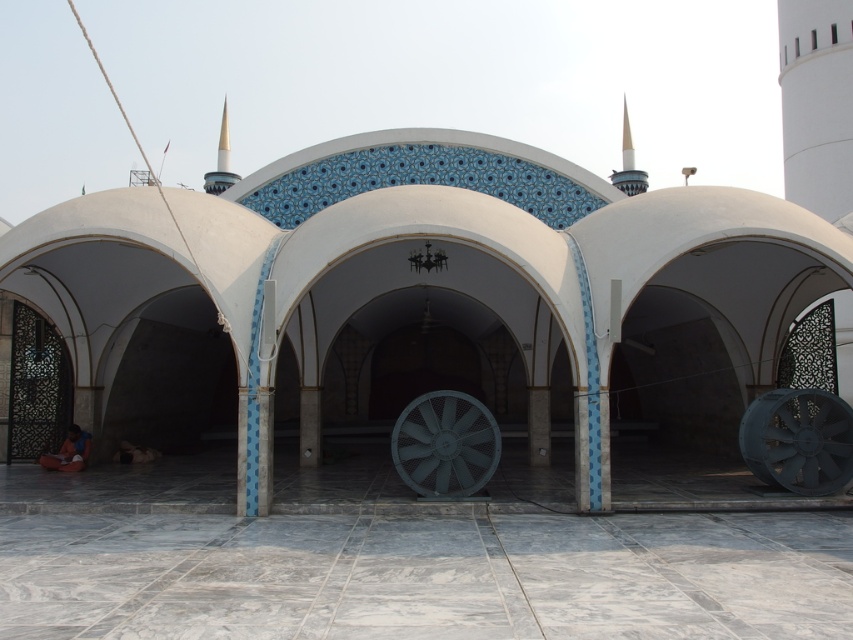
Can you confirm if metallic gray fan at lower right is positioned to the right of gray metallic fan at center?

Indeed, metallic gray fan at lower right is positioned on the right side of gray metallic fan at center.

Which is more to the right, metallic gray fan at lower right or gray metallic fan at center?

metallic gray fan at lower right is more to the right.

This screenshot has width=853, height=640. Describe the element at coordinates (798, 440) in the screenshot. I see `metallic gray fan at lower right` at that location.

What are the coordinates of `metallic gray fan at lower right` in the screenshot? It's located at (798, 440).